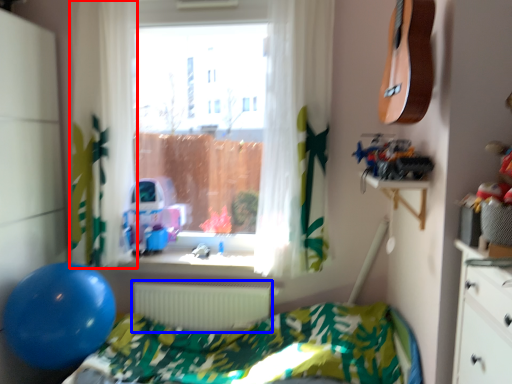
Question: Among these objects, which one is farthest to the camera, curtain (highlighted by a red box) or radiator (highlighted by a blue box)?

Choices:
 (A) curtain
 (B) radiator

Answer: (B)